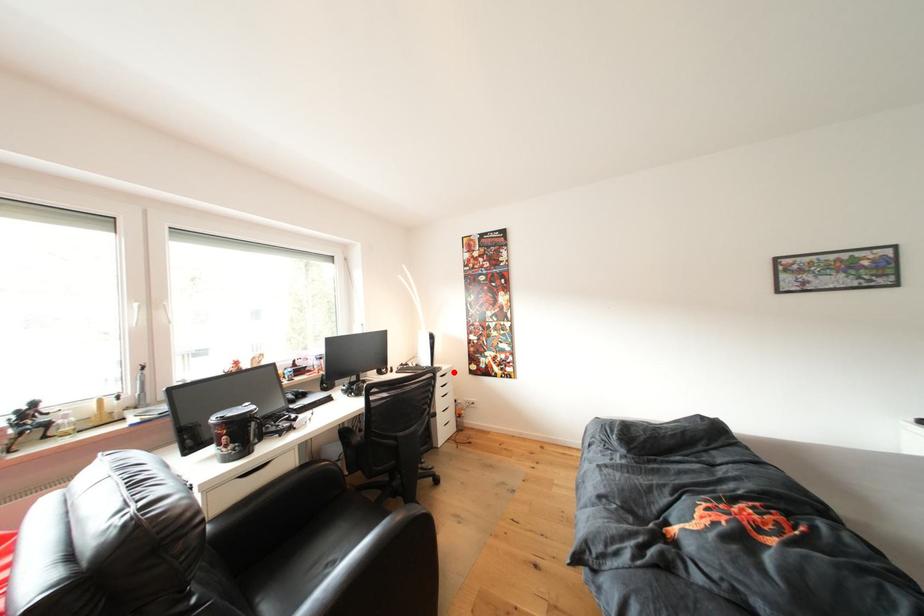
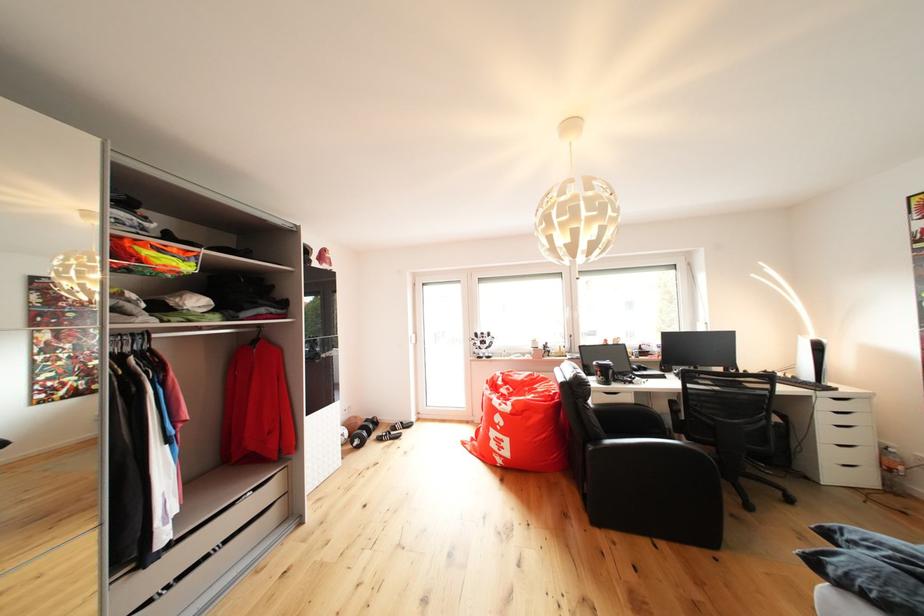
The point at the highlighted location is marked in the first image. Where is the corresponding point in the second image?

(855, 395)